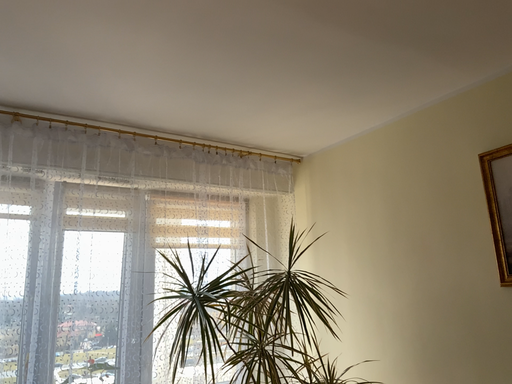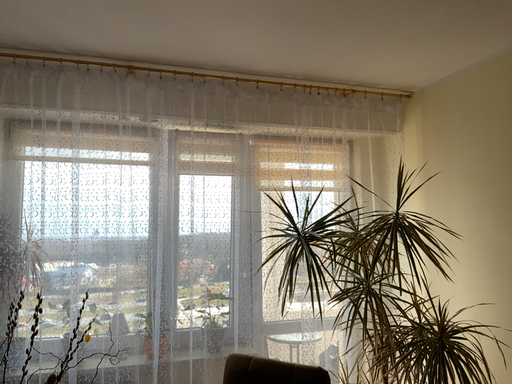
Question: How did the camera likely rotate when shooting the video?

Choices:
 (A) rotated upward
 (B) rotated downward

Answer: (B)